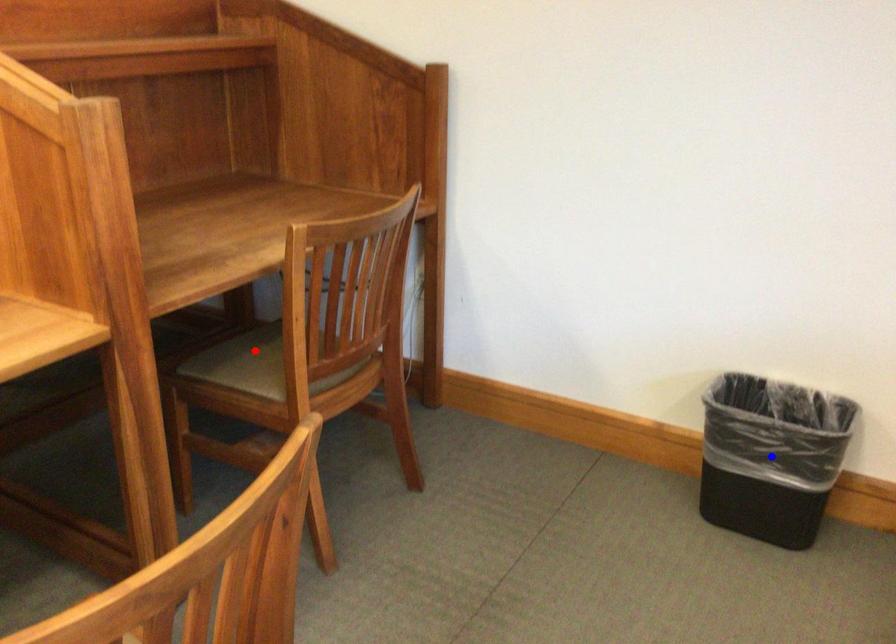
Question: Which of the two points in the image is closer to the camera?

Choices:
 (A) Blue point is closer.
 (B) Red point is closer.

Answer: (A)